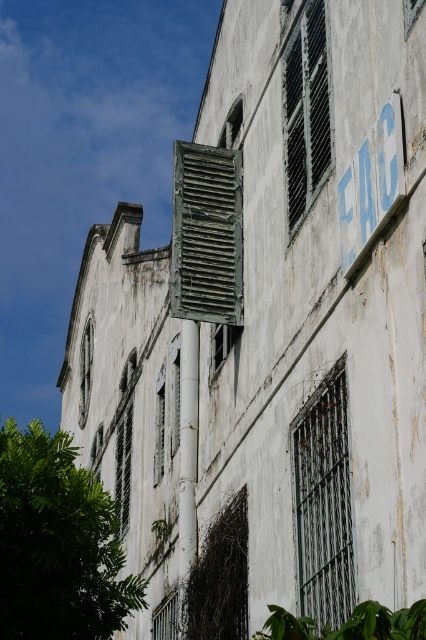
You are standing in front of the building and want to read the blue painted sign at upper right. However, there is a green leafy tree at lower left blocking your view. Can you see the sign clearly?

The blue painted sign at upper right is behind the green leafy tree at lower left, so the tree is blocking your view of the sign. You cannot see the sign clearly.